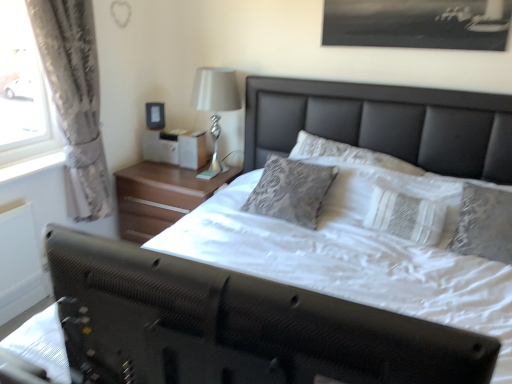
Find the location of a particular element. white fabric bed at center is located at coordinates (246, 324).

What are the coordinates of `white textured curtain at left` in the screenshot? It's located at (75, 100).

The width and height of the screenshot is (512, 384). I want to click on white glossy lamp at upper right, so click(215, 105).

At what (x,y) coordinates should I click in order to perform the action: click on matte black picture frame at upper center. Please return your answer as a coordinate pair (x, y). Image resolution: width=512 pixels, height=384 pixels. Looking at the image, I should click on (155, 115).

In order to click on white fabric bed at center in this screenshot , I will do `click(246, 324)`.

Are wooden nightstand at center and white fabric bed at center making contact?

No.

Considering the relative positions of wooden nightstand at center and white fabric bed at center in the image provided, is wooden nightstand at center to the right of white fabric bed at center from the viewer's perspective?

Incorrect, wooden nightstand at center is not on the right side of white fabric bed at center.

Between wooden nightstand at center and white fabric bed at center, which one is positioned behind?

wooden nightstand at center is more distant.

Is wooden nightstand at center completely or partially outside of white fabric bed at center?

Absolutely, wooden nightstand at center is external to white fabric bed at center.

Measure the distance from white glossy lamp at upper right to matte black picture frame at upper center.

A distance of 21.89 inches exists between white glossy lamp at upper right and matte black picture frame at upper center.

Considering the points (221, 109) and (146, 104), which point is in front, point (221, 109) or point (146, 104)?

The point (221, 109) is more forward.

Image resolution: width=512 pixels, height=384 pixels. I want to click on bedside lamp lying in front of the matte black picture frame at upper center, so pos(215,105).

Is white glossy lamp at upper right touching matte black picture frame at upper center?

There is a gap between white glossy lamp at upper right and matte black picture frame at upper center.

Is wooden nightstand at center taller or shorter than white textured pillow at center?

Clearly, wooden nightstand at center is taller compared to white textured pillow at center.

From the image's perspective, which is above, wooden nightstand at center or white textured pillow at center?

white textured pillow at center is shown above in the image.

Find the location of a particular element. The image size is (512, 384). nightstand behind the white textured pillow at center is located at coordinates (160, 196).

From the image's perspective, which one is positioned higher, white textured curtain at left or white glossy lamp at upper right?

white glossy lamp at upper right, from the image's perspective.

The height and width of the screenshot is (384, 512). Find the location of `curtain in front of the white glossy lamp at upper right`. curtain in front of the white glossy lamp at upper right is located at coordinates (75, 100).

Is white textured curtain at left taller than white glossy lamp at upper right?

Yes, white textured curtain at left is taller than white glossy lamp at upper right.

In the scene shown: Visually, is white fabric bed at center positioned to the left or to the right of white textured curtain at left?

white fabric bed at center is positioned on white textured curtain at left's right side.

What's the angular difference between white fabric bed at center and white textured curtain at left's facing directions?

The facing directions of white fabric bed at center and white textured curtain at left are 90.4 degrees apart.

Does white fabric bed at center come behind white textured curtain at left?

No, it is in front of white textured curtain at left.

Measure the distance between wooden nightstand at center and white glossy lamp at upper right.

15.38 inches.

At what (x,y) coordinates should I click in order to perform the action: click on bedside lamp on the right of wooden nightstand at center. Please return your answer as a coordinate pair (x, y). This screenshot has height=384, width=512. Looking at the image, I should click on (215, 105).

In the scene shown: Considering the sizes of objects wooden nightstand at center and white glossy lamp at upper right in the image provided, who is thinner, wooden nightstand at center or white glossy lamp at upper right?

white glossy lamp at upper right.

Relative to white glossy lamp at upper right, is wooden nightstand at center in front or behind?

Visually, wooden nightstand at center is located behind white glossy lamp at upper right.

Is white textured pillow at center at the right side of white textured curtain at left?

Yes.

From the image's perspective, is white textured pillow at center positioned above or below white textured curtain at left?

Based on their image positions, white textured pillow at center is located beneath white textured curtain at left.

In the scene shown: From a real-world perspective, is white textured pillow at center physically located above or below white textured curtain at left?

Clearly, from a real-world perspective, white textured pillow at center is below white textured curtain at left.

Does white textured pillow at center have a lesser height compared to white textured curtain at left?

Yes.

Locate an element on the screen. The width and height of the screenshot is (512, 384). nightstand below the white fabric bed at center (from a real-world perspective) is located at coordinates (160, 196).

This screenshot has width=512, height=384. Find the location of `picture frame above the white glossy lamp at upper right (from the image's perspective)`. picture frame above the white glossy lamp at upper right (from the image's perspective) is located at coordinates (155, 115).

From the image, which object appears to be nearer to white glossy lamp at upper right, white textured pillow at center or white textured curtain at left?

Based on the image, white textured curtain at left appears to be nearer to white glossy lamp at upper right.

Which object lies nearer to the anchor point matte black picture frame at upper center, white textured pillow at center or white glossy lamp at upper right?

Based on the image, white glossy lamp at upper right appears to be nearer to matte black picture frame at upper center.

Which object lies further to the anchor point white fabric bed at center, white textured pillow at center or white textured curtain at left?

The object further to white fabric bed at center is white textured curtain at left.

In the scene shown: Based on their spatial positions, is wooden nightstand at center or white textured pillow at center further from white textured curtain at left?

white textured pillow at center is positioned further to the anchor white textured curtain at left.

From the image, which object appears to be farther from white fabric bed at center, white textured curtain at left or wooden nightstand at center?

Among the two, wooden nightstand at center is located further to white fabric bed at center.

Considering their positions, is wooden nightstand at center positioned closer to white textured curtain at left than matte black picture frame at upper center?

wooden nightstand at center lies closer to white textured curtain at left than the other object.

Looking at the image, which one is located further to white textured pillow at center, matte black picture frame at upper center or wooden nightstand at center?

matte black picture frame at upper center is further to white textured pillow at center.

From the image, which object appears to be farther from white fabric bed at center, white glossy lamp at upper right or matte black picture frame at upper center?

Based on the image, matte black picture frame at upper center appears to be further to white fabric bed at center.

At what (x,y) coordinates should I click in order to perform the action: click on pillow located between white fabric bed at center and white textured curtain at left in the depth direction. Please return your answer as a coordinate pair (x, y). This screenshot has height=384, width=512. Looking at the image, I should click on (407, 187).

You are a GUI agent. You are given a task and a screenshot of the screen. Output one action in this format:
    pyautogui.click(x=<x>, y=<y>)
    Task: Click on the nightstand between white textured curtain at left and matte black picture frame at upper center along the z-axis
    Image resolution: width=512 pixels, height=384 pixels.
    Given the screenshot: What is the action you would take?
    pyautogui.click(x=160, y=196)

Locate an element on the screen. The width and height of the screenshot is (512, 384). pillow located between white fabric bed at center and white glossy lamp at upper right in the depth direction is located at coordinates (407, 187).

Where is `pillow located between white fabric bed at center and matte black picture frame at upper center in the depth direction`? pillow located between white fabric bed at center and matte black picture frame at upper center in the depth direction is located at coordinates coord(407,187).